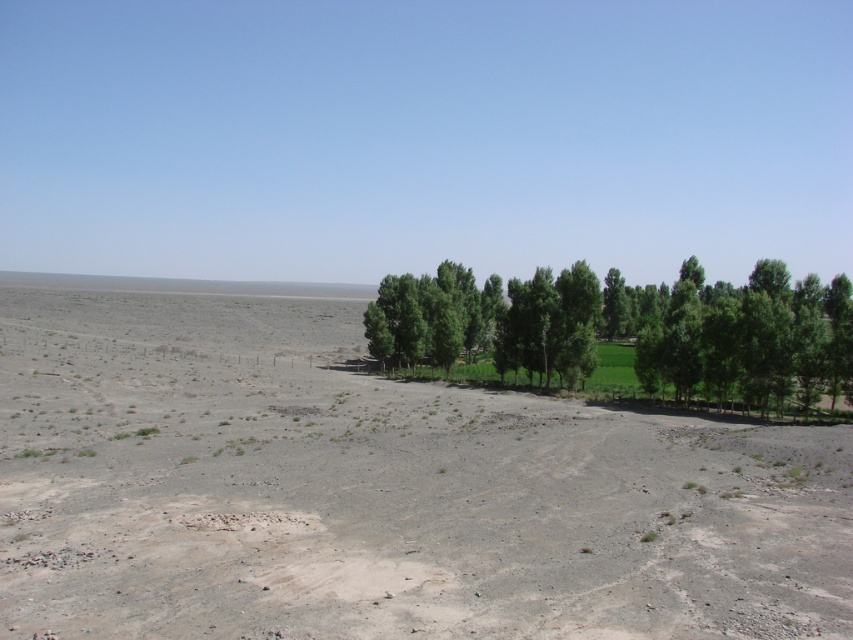
Question: Is gray/dry/dirt field at center to the right of green leafy trees at right from the viewer's perspective?

Choices:
 (A) no
 (B) yes

Answer: (A)

Question: Can you confirm if gray/dry/dirt field at center is positioned to the right of green leafy trees at right?

Choices:
 (A) yes
 (B) no

Answer: (B)

Question: Which object is closer to the camera taking this photo?

Choices:
 (A) gray/dry/dirt field at center
 (B) green leafy trees at right

Answer: (A)

Question: Is gray/dry/dirt field at center thinner than green leafy trees at right?

Choices:
 (A) yes
 (B) no

Answer: (B)

Question: Which object is farther from the camera taking this photo?

Choices:
 (A) green leafy trees at right
 (B) gray/dry/dirt field at center

Answer: (A)

Question: Which object is farther from the camera taking this photo?

Choices:
 (A) green leafy trees at right
 (B) gray/dry/dirt field at center

Answer: (A)